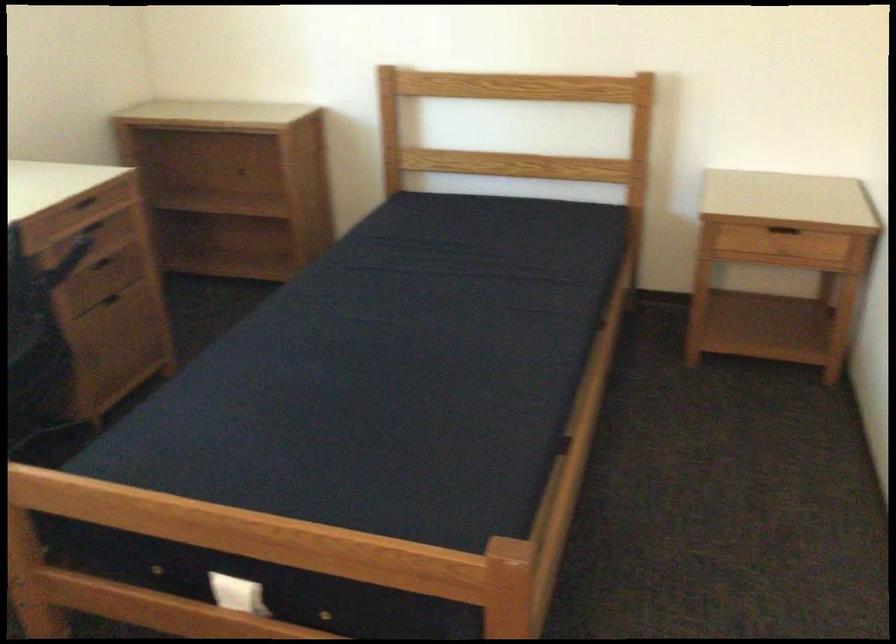
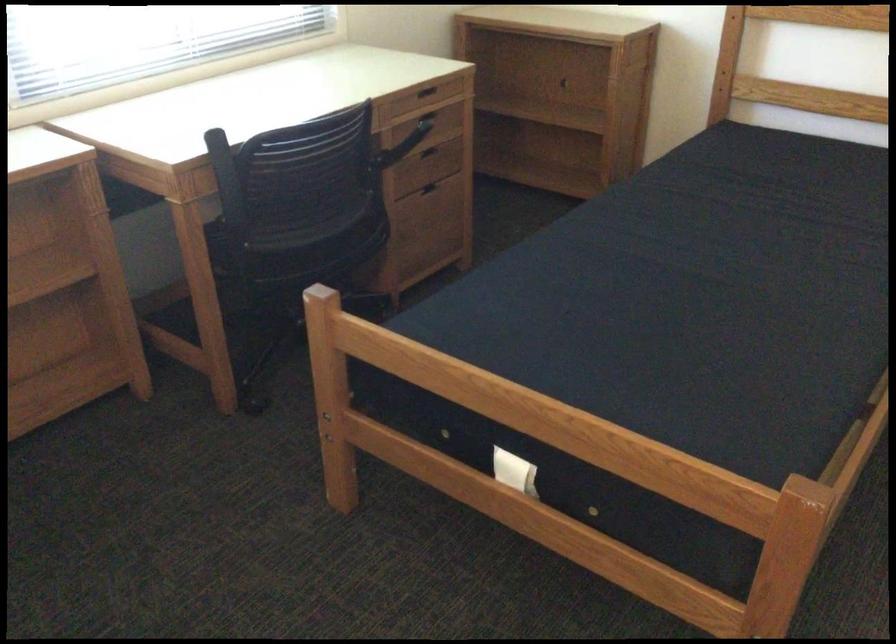
Question: The first image is from the beginning of the video and the second image is from the end. How did the camera likely rotate when shooting the video?

Choices:
 (A) Left
 (B) Right
 (C) Up
 (D) Down

Answer: (A)